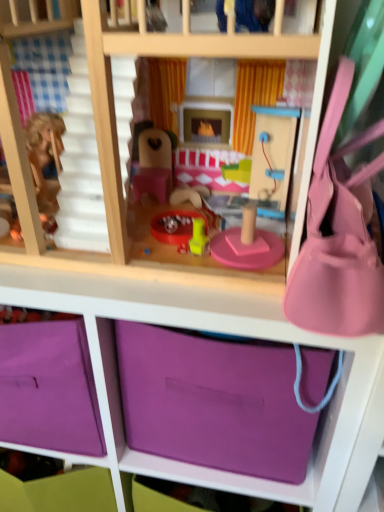
Image resolution: width=384 pixels, height=512 pixels. Find the location of `free region on the left part of pink fabric purse at right`. free region on the left part of pink fabric purse at right is located at coordinates point(214,293).